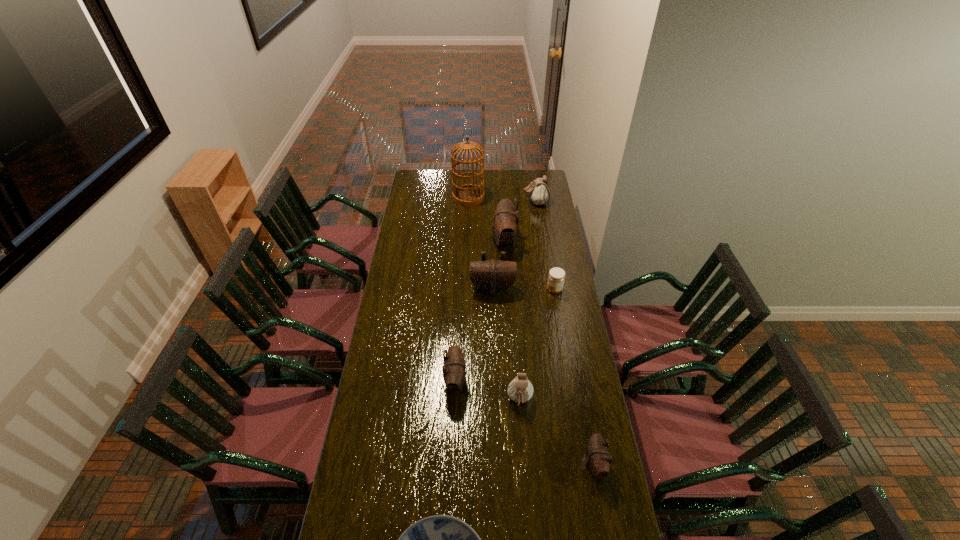
Where is `object positioned at the far edge`? The height and width of the screenshot is (540, 960). object positioned at the far edge is located at coordinates (468, 195).

In order to click on jam that is at the right edge in this screenshot , I will do `click(556, 277)`.

At what (x,y) coordinates should I click in order to perform the action: click on blank space at the far edge of the desktop. Please return your answer as a coordinate pair (x, y). This screenshot has height=540, width=960. Looking at the image, I should click on click(x=449, y=179).

This screenshot has width=960, height=540. In order to click on free space at the left edge of the desktop in this screenshot , I will do click(409, 256).

In the image, there is a desktop. Where is `free space at the right edge`? free space at the right edge is located at coordinates (584, 470).

At what (x,y) coordinates should I click in order to perform the action: click on free area in between the second smallest brown pouch and the tallest pouch. Please return your answer as a coordinate pair (x, y). Looking at the image, I should click on (480, 312).

I want to click on vacant region between the smaller white pouch and the second nearest brown pouch, so click(488, 391).

The height and width of the screenshot is (540, 960). I want to click on vacant region between the second biggest brown pouch and the second nearest brown pouch, so click(474, 335).

At what (x,y) coordinates should I click in order to perform the action: click on vacant space that is in between the rightmost brown pouch and the birdcage. Please return your answer as a coordinate pair (x, y). This screenshot has width=960, height=540. Looking at the image, I should click on (532, 331).

Locate an element on the screen. The width and height of the screenshot is (960, 540). vacant area that lies between the rightmost brown pouch and the second nearest brown pouch is located at coordinates (525, 423).